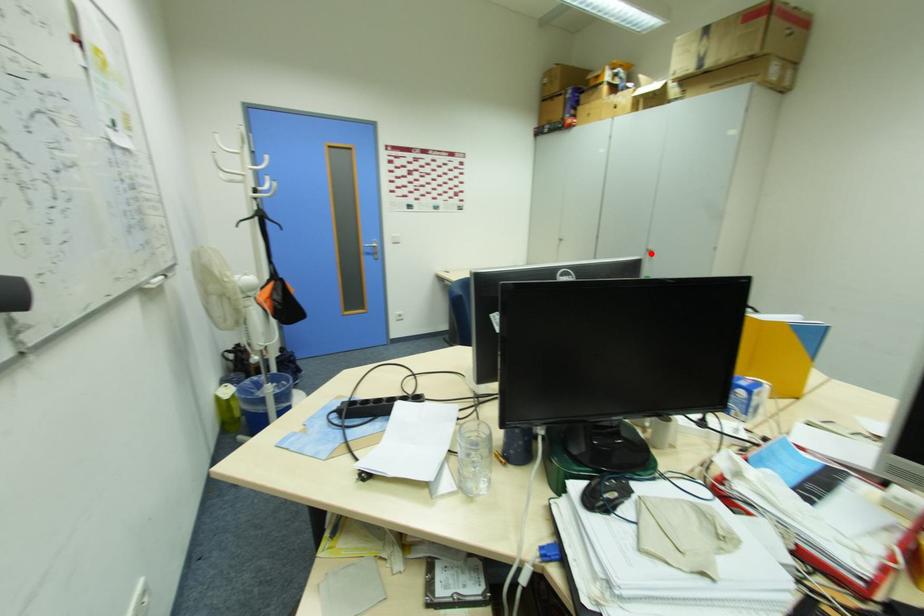
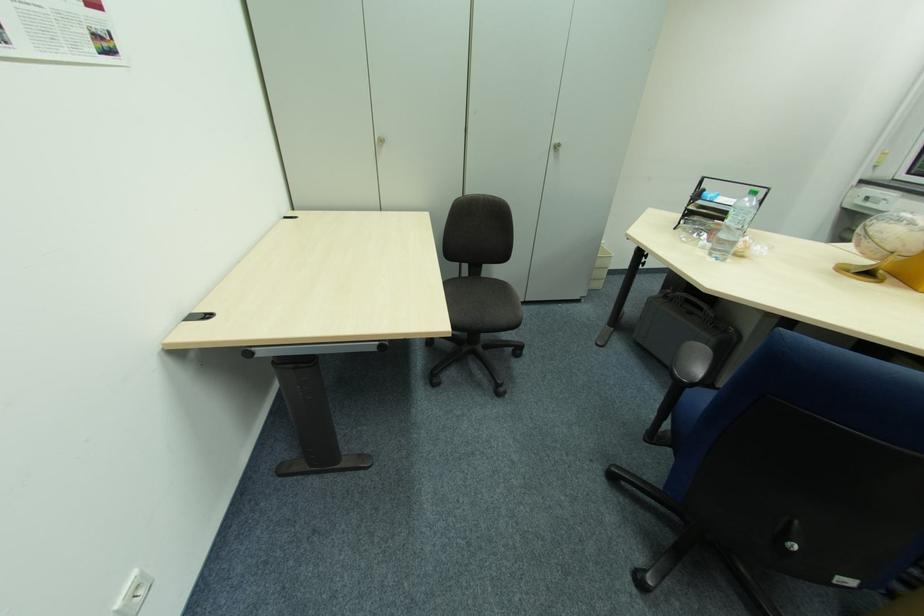
Question: I am providing you with two images of the same scene from different viewpoints. Image1 has a red point marked. In image2, the corresponding 3D location appears at what relative position? Reply with the corresponding letter.

Choices:
 (A) Closer
 (B) Farther

Answer: (A)